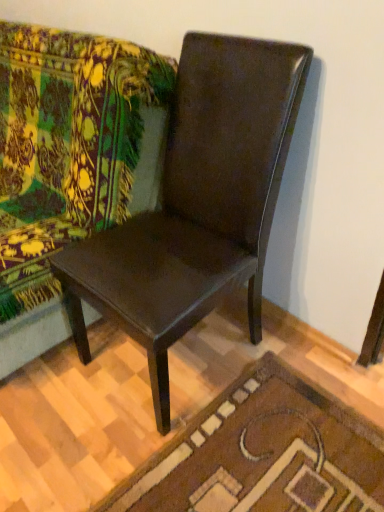
Question: Is brown textured rug at lower center situated inside green floral fabric couch at upper left or outside?

Choices:
 (A) outside
 (B) inside

Answer: (A)

Question: From the image's perspective, is brown textured rug at lower center positioned above or below green floral fabric couch at upper left?

Choices:
 (A) above
 (B) below

Answer: (B)

Question: Which is nearer to the brown textured rug at lower center?

Choices:
 (A) glossy brown chair at center
 (B) green floral fabric couch at upper left

Answer: (A)

Question: Which object is the farthest from the green floral fabric couch at upper left?

Choices:
 (A) glossy brown chair at center
 (B) brown textured rug at lower center

Answer: (B)